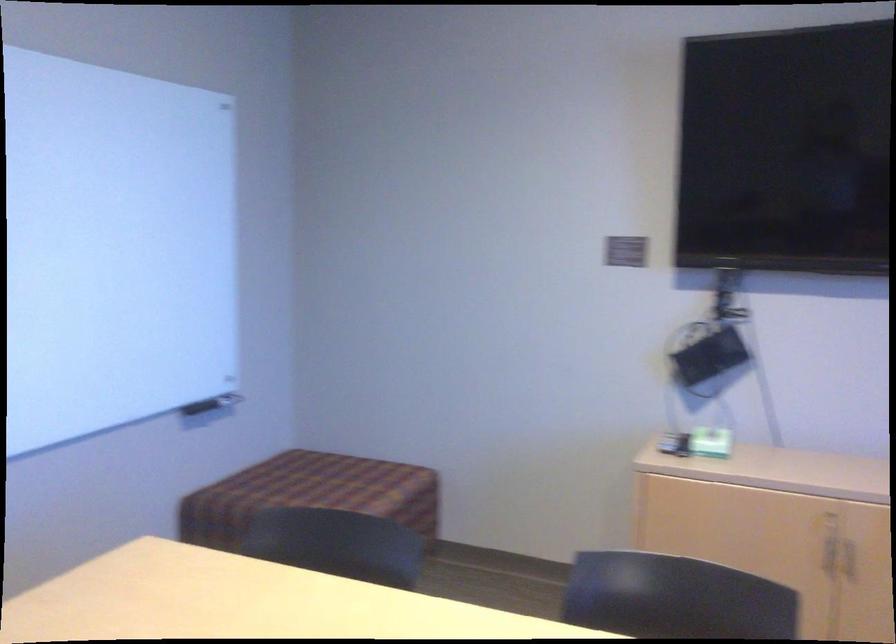
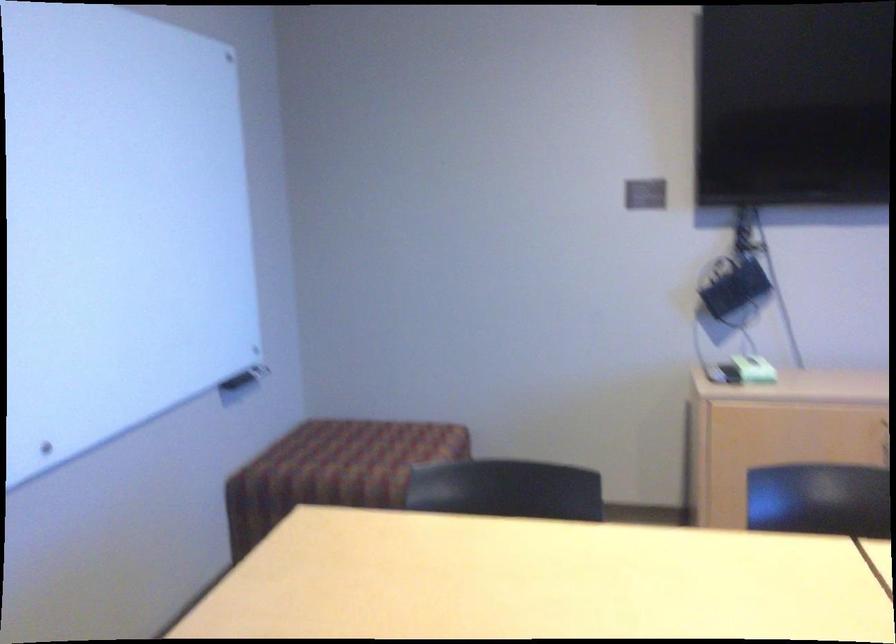
Locate, in the second image, the point that corresponds to (x=710, y=357) in the first image.

(734, 289)